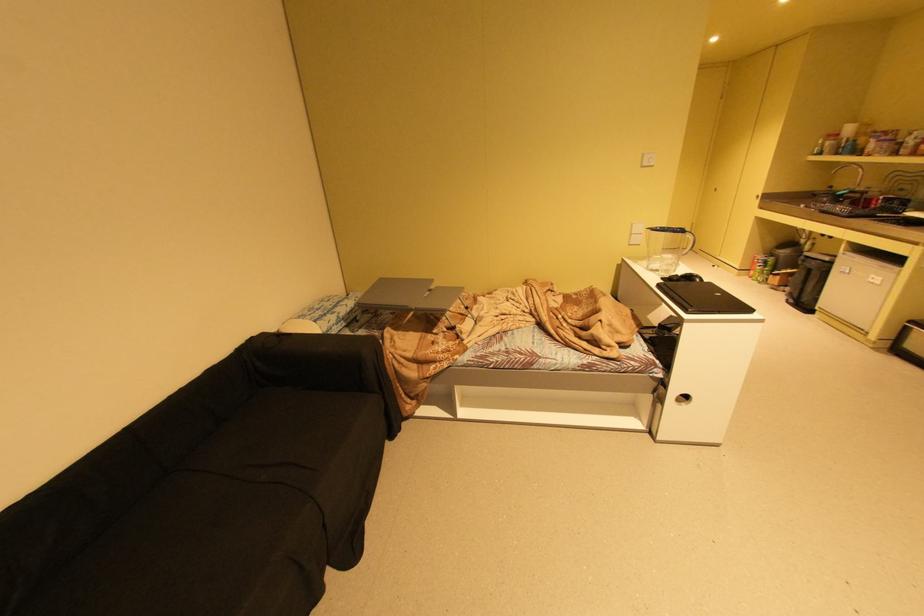
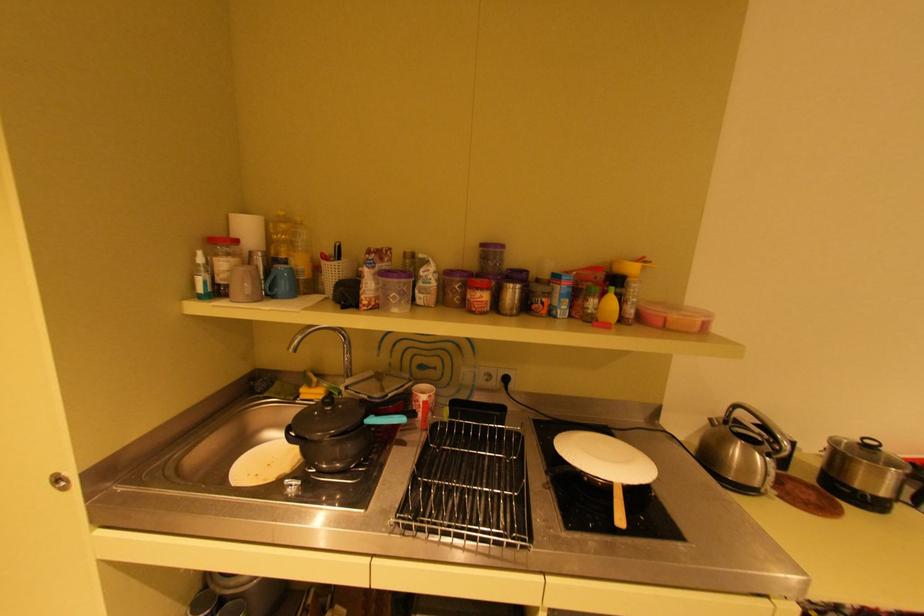
In the second image, find the point that corresponds to (821,155) in the first image.

(208, 297)